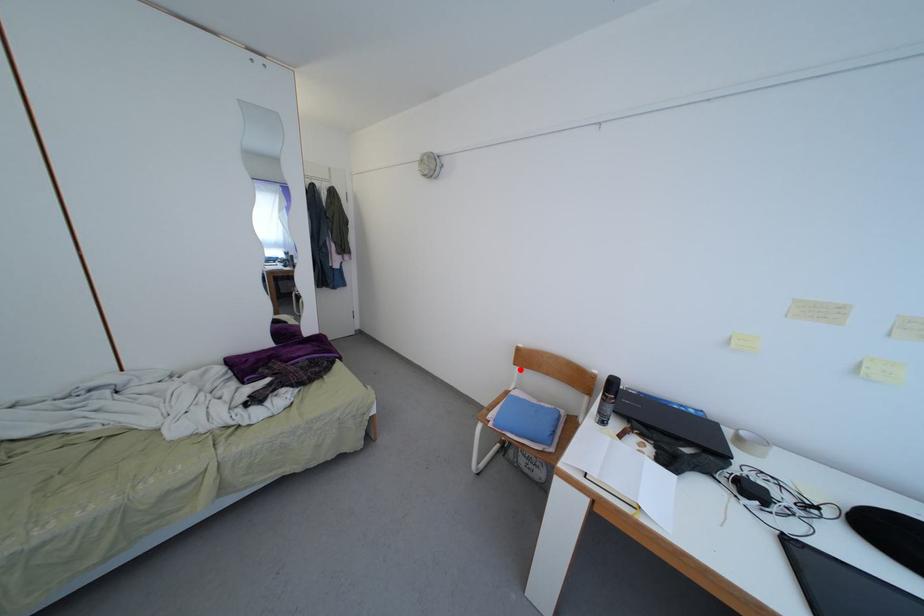
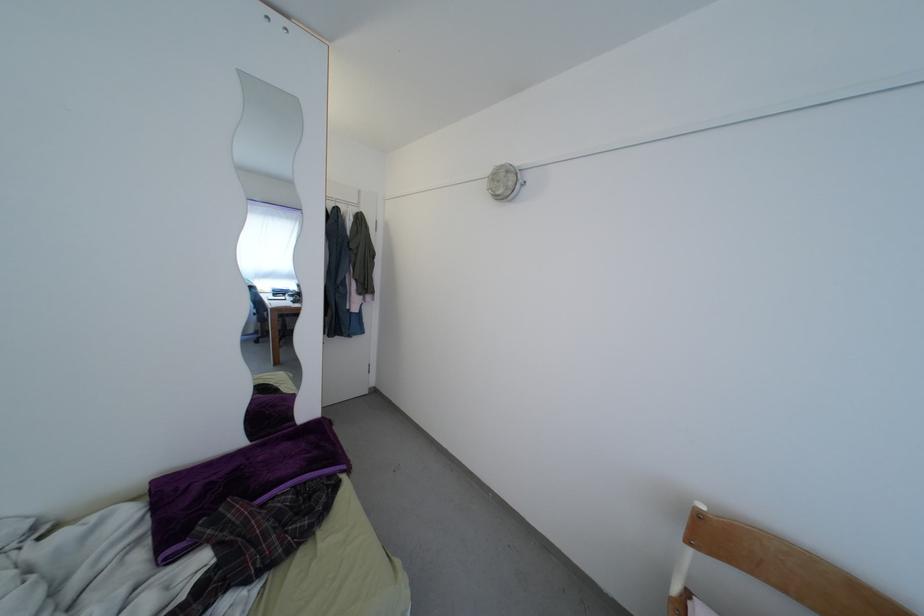
Question: I am providing you with two images of the same scene from different viewpoints. Image1 has a red point marked. In image2, the corresponding 3D location appears at what relative position? Reply with the corresponding letter.

Choices:
 (A) Closer
 (B) Farther

Answer: (A)